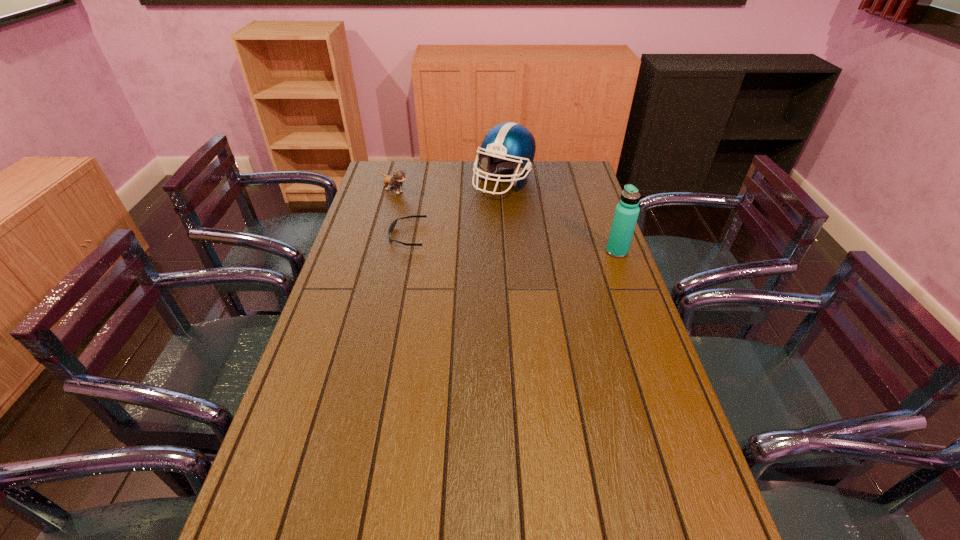
Image resolution: width=960 pixels, height=540 pixels. I want to click on vacant space in between the shortest object and the third object from left to right, so pos(455,208).

Locate an element on the screen. empty location between the kitten and the second object from right to left is located at coordinates (448, 186).

Where is `object that stands as the second closest to the sunglasses`? The image size is (960, 540). object that stands as the second closest to the sunglasses is located at coordinates (507, 145).

Locate an element on the screen. The height and width of the screenshot is (540, 960). object that is the closest one to the sunglasses is located at coordinates (395, 181).

Image resolution: width=960 pixels, height=540 pixels. I want to click on free location that satisfies the following two spatial constraints: 1. on the front side of the third tallest object; 2. on the left side of the water bottle, so click(x=377, y=252).

Where is `vacant space that satisfies the following two spatial constraints: 1. on the front side of the third tallest object; 2. on the right side of the rightmost object`? vacant space that satisfies the following two spatial constraints: 1. on the front side of the third tallest object; 2. on the right side of the rightmost object is located at coordinates (377, 252).